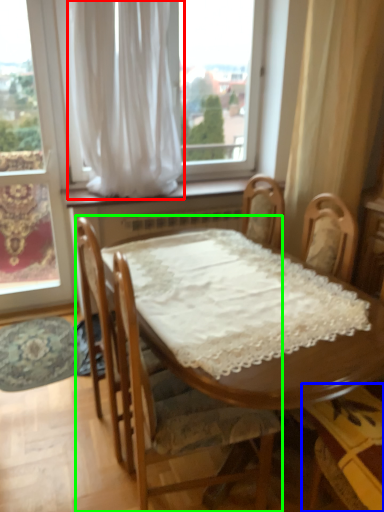
Question: Based on their relative distances, which object is farther from curtain (highlighted by a red box)? Choose from chair (highlighted by a blue box) and chair (highlighted by a green box).

Choices:
 (A) chair
 (B) chair

Answer: (A)